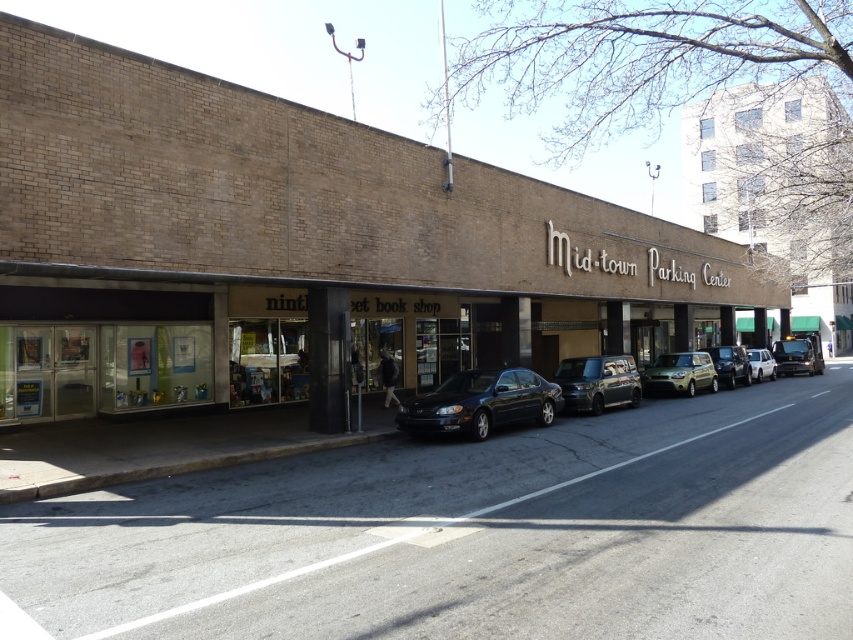
Question: Does matte brown building at center have a greater width compared to metallic silver van at right?

Choices:
 (A) no
 (B) yes

Answer: (B)

Question: Among these points, which one is nearest to the camera?

Choices:
 (A) (775, 349)
 (B) (293, 628)
 (C) (741, 369)

Answer: (B)

Question: Which point is closer to the camera taking this photo?

Choices:
 (A) (573, 362)
 (B) (453, 394)

Answer: (B)

Question: Does metallic silver car at center appear on the right side of white matte van at right?

Choices:
 (A) no
 (B) yes

Answer: (A)

Question: Which point is farther to the camera?

Choices:
 (A) (549, 413)
 (B) (314, 464)
 (C) (746, 384)
 (D) (177, 356)

Answer: (C)

Question: Where is matte brown building at center located in relation to metallic silver van at right in the image?

Choices:
 (A) above
 (B) below

Answer: (A)